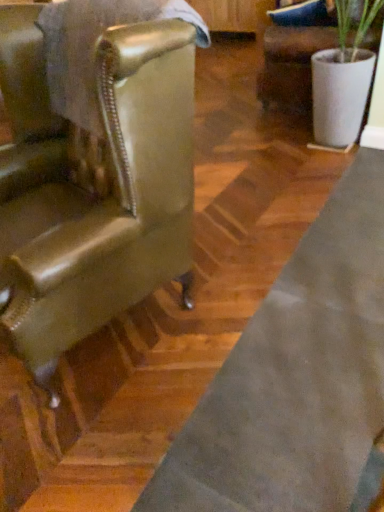
You are a GUI agent. You are given a task and a screenshot of the screen. Output one action in this format:
    pyautogui.click(x=<x>, y=<y>)
    Task: Click on the matte green leather chair at left
    The image size is (384, 512).
    Given the screenshot: What is the action you would take?
    pyautogui.click(x=92, y=166)

Describe the element at coordinates (92, 166) in the screenshot. The height and width of the screenshot is (512, 384). I see `matte green leather chair at left` at that location.

Measure the distance between point (61, 232) and camera.

A distance of 1.13 meters exists between point (61, 232) and camera.

In order to click on matte green leather chair at left in this screenshot , I will do `click(92, 166)`.